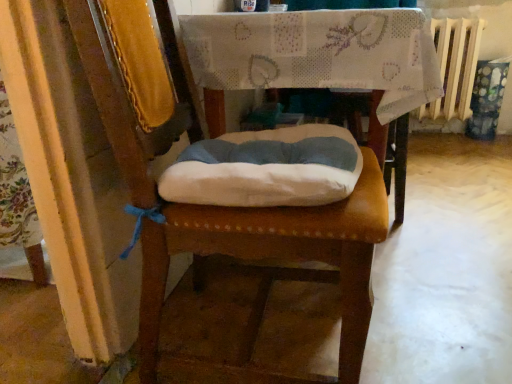
This screenshot has height=384, width=512. Identify the location of white painted metal radiator at upper right. (454, 67).

Considering the sizes of fabric-covered table at center and leather cushion at center in the image, is fabric-covered table at center taller or shorter than leather cushion at center?

In the image, fabric-covered table at center appears to be shorter than leather cushion at center.

From the image's perspective, is fabric-covered table at center under leather cushion at center?

No, from the image's perspective, fabric-covered table at center is not below leather cushion at center.

Considering the points (292, 70) and (113, 96), which point is in front, point (292, 70) or point (113, 96)?

The point (113, 96) is closer.

Can we say fabric-covered table at center lies outside leather cushion at center?

Absolutely, fabric-covered table at center is external to leather cushion at center.

Considering the sizes of objects leather cushion at center and fabric-covered table at center in the image provided, who is thinner, leather cushion at center or fabric-covered table at center?

leather cushion at center is thinner.

From a real-world perspective, who is located lower, leather cushion at center or fabric-covered table at center?

In real-world perspective, fabric-covered table at center is lower.

Would you say leather cushion at center is to the left or to the right of fabric-covered table at center in the picture?

leather cushion at center is positioned on fabric-covered table at center's left side.

Does leather cushion at center have a lesser height compared to fabric-covered table at center?

No.

Considering the positions of point (413, 114) and point (357, 310), is point (413, 114) closer or farther from the camera than point (357, 310)?

Point (413, 114) appears to be farther away from the viewer than point (357, 310).

Identify the location of chair in front of the white painted metal radiator at upper right. The height and width of the screenshot is (384, 512). (269, 269).

Is white painted metal radiator at upper right next to leather cushion at center?

No, white painted metal radiator at upper right is not beside leather cushion at center.

How different are the orientations of white painted metal radiator at upper right and leather cushion at center in degrees?

The angular difference between white painted metal radiator at upper right and leather cushion at center is 88.6 degrees.

Can you tell me how much white painted metal radiator at upper right and fabric-covered table at center differ in facing direction?

89.4 degrees.

From a real-world perspective, relative to fabric-covered table at center, is white painted metal radiator at upper right vertically above or below?

Clearly, from a real-world perspective, white painted metal radiator at upper right is above fabric-covered table at center.

From the image's perspective, which is below, white painted metal radiator at upper right or fabric-covered table at center?

fabric-covered table at center is shown below in the image.

Is fabric-covered table at center oriented away from white painted metal radiator at upper right?

No, fabric-covered table at center's orientation is not away from white painted metal radiator at upper right.

From a real-world perspective, is fabric-covered table at center physically below white painted metal radiator at upper right?

Yes, from a real-world perspective, fabric-covered table at center is beneath white painted metal radiator at upper right.

Based on the photo, is fabric-covered table at center thinner than white painted metal radiator at upper right?

In fact, fabric-covered table at center might be wider than white painted metal radiator at upper right.

The image size is (512, 384). I want to click on radiator behind the leather cushion at center, so click(454, 67).

How many degrees apart are the facing directions of leather cushion at center and white painted metal radiator at upper right?

88.6 degrees separate the facing orientations of leather cushion at center and white painted metal radiator at upper right.

From the image's perspective, is leather cushion at center above or below white painted metal radiator at upper right?

leather cushion at center is situated lower than white painted metal radiator at upper right in the image.

Can you confirm if leather cushion at center is wider than white painted metal radiator at upper right?

Indeed, leather cushion at center has a greater width compared to white painted metal radiator at upper right.

This screenshot has height=384, width=512. Find the location of `table located on the right of leather cushion at center`. table located on the right of leather cushion at center is located at coordinates (318, 53).

Identify the location of table behind the leather cushion at center. (318, 53).

When comparing their distances from leather cushion at center, does white painted metal radiator at upper right or fabric-covered table at center seem closer?

Answer: The object closer to leather cushion at center is fabric-covered table at center.

Based on their spatial positions, is fabric-covered table at center or white painted metal radiator at upper right further from leather cushion at center?

Based on the image, white painted metal radiator at upper right appears to be further to leather cushion at center.

When comparing their distances from white painted metal radiator at upper right, does fabric-covered table at center or leather cushion at center seem closer?

fabric-covered table at center lies closer to white painted metal radiator at upper right than the other object.

From the image, which object appears to be nearer to fabric-covered table at center, white painted metal radiator at upper right or leather cushion at center?

leather cushion at center.

When comparing their distances from white painted metal radiator at upper right, does leather cushion at center or fabric-covered table at center seem further?

Among the two, leather cushion at center is located further to white painted metal radiator at upper right.

Which object lies further to the anchor point fabric-covered table at center, leather cushion at center or white painted metal radiator at upper right?

white painted metal radiator at upper right is further to fabric-covered table at center.

I want to click on table between leather cushion at center and white painted metal radiator at upper right from front to back, so click(318, 53).